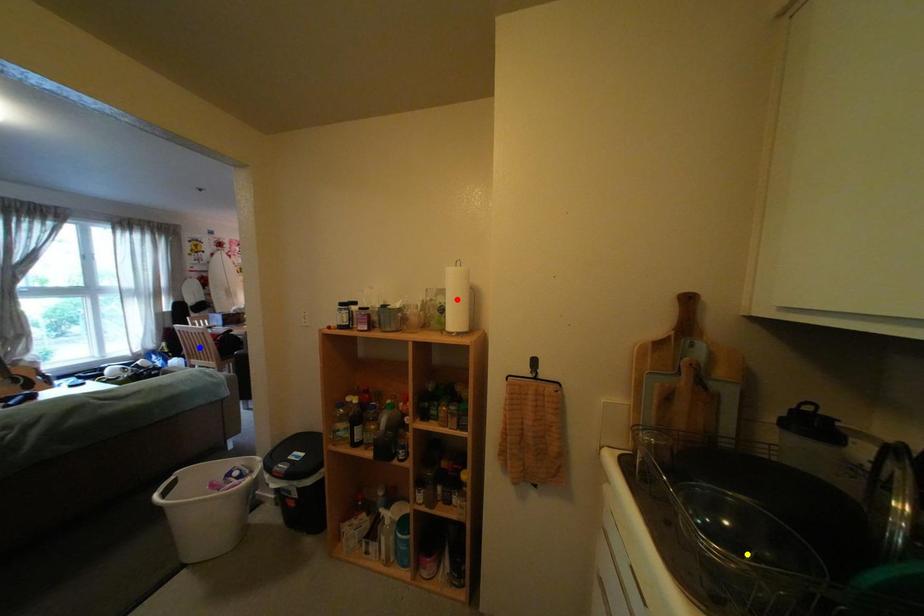
Order these from nearest to farthest:
1. red point
2. yellow point
3. blue point

yellow point < red point < blue point